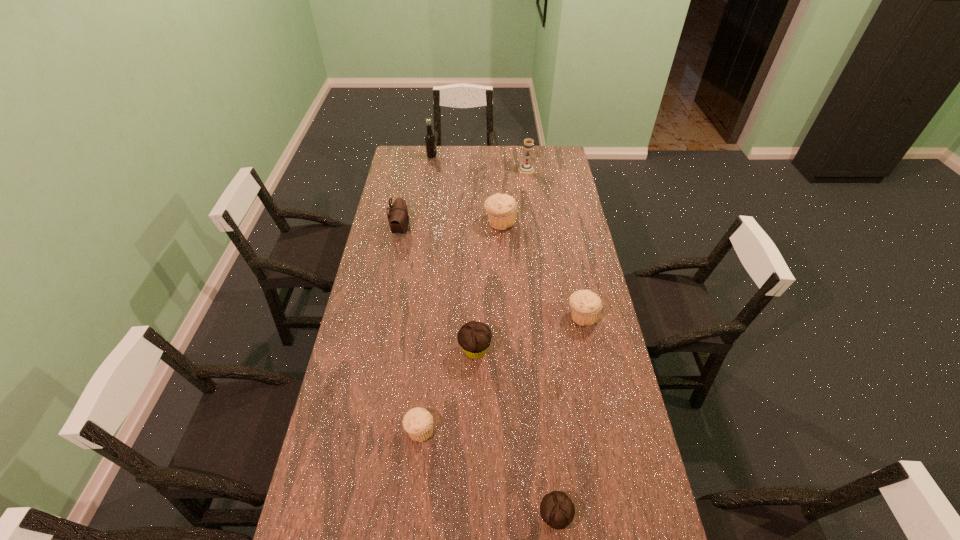
I want to click on vacant space situated on the back of the rightmost object, so click(575, 279).

The image size is (960, 540). Identify the location of vacant space located 0.120m on the right of the farther chocolate muffin. (526, 350).

Identify the location of free space located on the right of the leftmost muffin. (558, 430).

Locate an element on the screen. Image resolution: width=960 pixels, height=540 pixels. free space located 0.120m on the left of the right chocolate muffin is located at coordinates (492, 517).

The image size is (960, 540). What are the coordinates of `root beer positioned at the far edge` in the screenshot? It's located at (430, 141).

Find the location of `chalice at the far edge`. chalice at the far edge is located at coordinates (526, 168).

Identify the location of object that is at the left edge. The height and width of the screenshot is (540, 960). (398, 218).

I want to click on object that is at the right edge, so click(x=586, y=306).

You are a GUI agent. You are given a task and a screenshot of the screen. Output one action in this format:
    pyautogui.click(x=<x>, y=<y>)
    Task: Click on the vacant space at the far edge of the desktop
    The width and height of the screenshot is (960, 540).
    Given the screenshot: What is the action you would take?
    pyautogui.click(x=425, y=168)

This screenshot has height=540, width=960. Find the location of `vacant space at the left edge`. vacant space at the left edge is located at coordinates (364, 505).